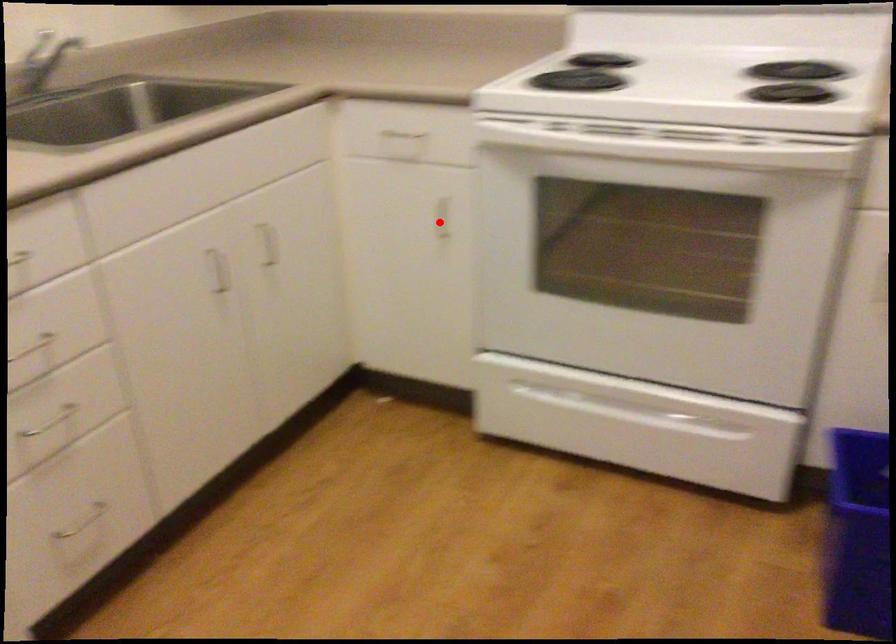
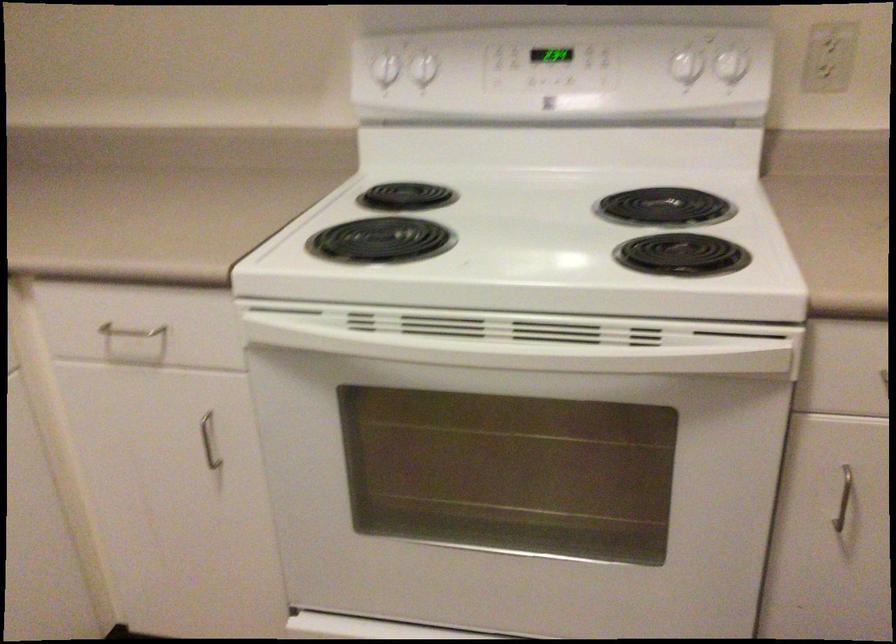
In the second image, find the point that corresponds to the highlighted location in the first image.

(209, 440)